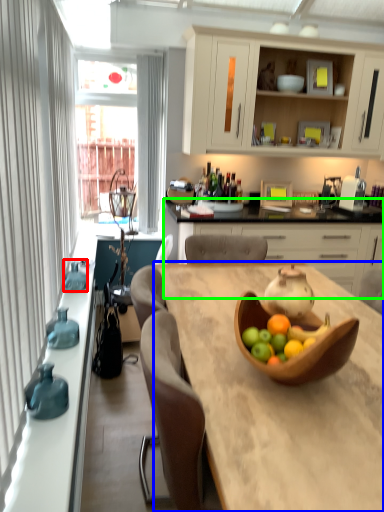
Question: Which is farther away from vase (highlighted by a red box)? desk (highlighted by a blue box) or cabinetry (highlighted by a green box)?

Choices:
 (A) desk
 (B) cabinetry

Answer: (B)